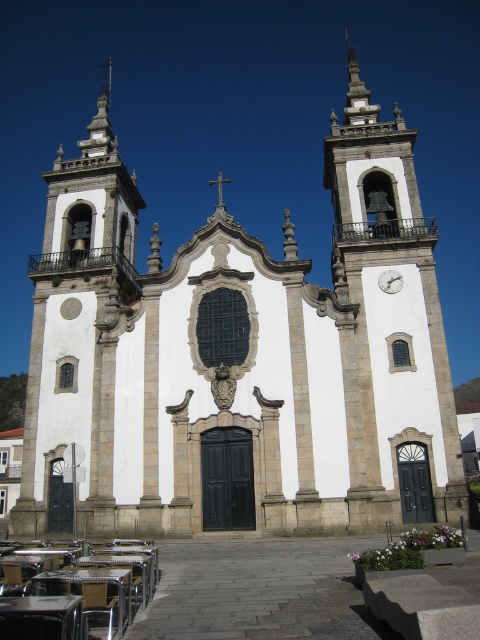
Question: Does white stone clock tower at upper center appear under white stone bell tower at left?

Choices:
 (A) yes
 (B) no

Answer: (B)

Question: Is white stone clock tower at upper center above white stone bell tower at left?

Choices:
 (A) no
 (B) yes

Answer: (B)

Question: Which point appears closest to the camera in this image?

Choices:
 (A) (85, 259)
 (B) (387, 284)
 (C) (422, 444)

Answer: (C)

Question: Which point appears closest to the camera in this image?

Choices:
 (A) (392, 170)
 (B) (389, 275)
 (C) (126, 268)

Answer: (B)

Question: Among these points, which one is nearest to the camera?

Choices:
 (A) (379, 358)
 (B) (84, 365)
 (C) (399, 278)

Answer: (A)

Question: Does white stone clock tower at upper center have a larger size compared to metallic silver clock at upper right?

Choices:
 (A) no
 (B) yes

Answer: (B)